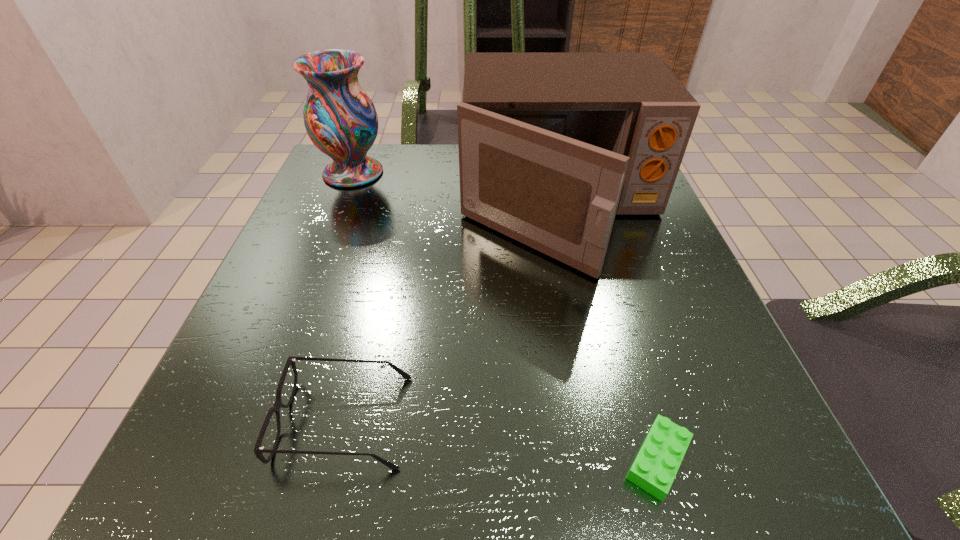
I want to click on free space between the microwave oven and the spectacles, so (x=452, y=314).

Where is `unoccupied position between the Lego and the second shortest object`? unoccupied position between the Lego and the second shortest object is located at coordinates (501, 440).

Find the location of a particular element. The height and width of the screenshot is (540, 960). free space between the spectacles and the shortest object is located at coordinates (501, 440).

Locate an element on the screen. The image size is (960, 540). free space between the spectacles and the microwave oven is located at coordinates (452, 314).

The height and width of the screenshot is (540, 960). Identify the location of the closest object to the vase. (552, 146).

At what (x,y) coordinates should I click in order to perform the action: click on object that is the third closest one to the vase. Please return your answer as a coordinate pair (x, y). Looking at the image, I should click on (656, 465).

Where is `blank space that satisfies the following two spatial constraints: 1. with the door open on the front of the microwave oven; 2. with the lenses facing outward on the second shortest object`? blank space that satisfies the following two spatial constraints: 1. with the door open on the front of the microwave oven; 2. with the lenses facing outward on the second shortest object is located at coordinates (608, 421).

Image resolution: width=960 pixels, height=540 pixels. Identify the location of free location that satisfies the following two spatial constraints: 1. with the door open on the front of the microwave oven; 2. with the lenses facing outward on the third tallest object. (608, 421).

What are the coordinates of `vacant region that satisfies the following two spatial constraints: 1. on the back side of the shortest object; 2. with the lenses facing outward on the spectacles` in the screenshot? It's located at (646, 421).

Where is `free space that satisfies the following two spatial constraints: 1. with the lenses facing outward on the shortest object; 2. on the right side of the third tallest object`? The width and height of the screenshot is (960, 540). free space that satisfies the following two spatial constraints: 1. with the lenses facing outward on the shortest object; 2. on the right side of the third tallest object is located at coordinates (336, 460).